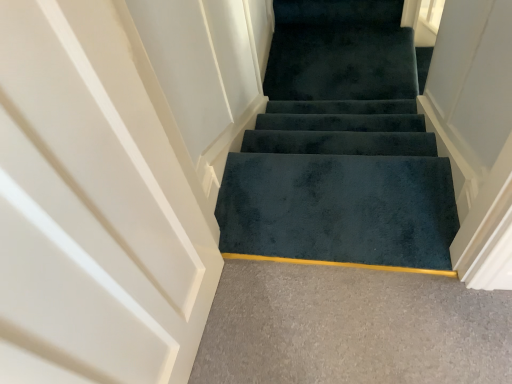
Question: Does dark blue carpet at center have a greater height compared to dark green carpet at center?

Choices:
 (A) yes
 (B) no

Answer: (B)

Question: Does dark blue carpet at center appear on the right side of dark green carpet at center?

Choices:
 (A) yes
 (B) no

Answer: (A)

Question: From a real-world perspective, is dark blue carpet at center positioned under dark green carpet at center based on gravity?

Choices:
 (A) yes
 (B) no

Answer: (A)

Question: Considering the relative positions of dark blue carpet at center and dark green carpet at center in the image provided, is dark blue carpet at center to the left of dark green carpet at center from the viewer's perspective?

Choices:
 (A) yes
 (B) no

Answer: (B)

Question: Is dark green carpet at center at the back of dark blue carpet at center?

Choices:
 (A) no
 (B) yes

Answer: (A)

Question: Is dark blue carpet at center behind dark green carpet at center?

Choices:
 (A) no
 (B) yes

Answer: (B)

Question: Considering the relative sizes of dark blue carpet at center and dark blue carpet at center in the image provided, is dark blue carpet at center shorter than dark blue carpet at center?

Choices:
 (A) yes
 (B) no

Answer: (A)

Question: From the image's perspective, does dark blue carpet at center appear lower than dark blue carpet at center?

Choices:
 (A) no
 (B) yes

Answer: (B)

Question: From a real-world perspective, is dark blue carpet at center on dark blue carpet at center?

Choices:
 (A) no
 (B) yes

Answer: (B)

Question: Is the depth of dark blue carpet at center greater than that of dark blue carpet at center?

Choices:
 (A) yes
 (B) no

Answer: (B)

Question: Considering the relative positions of dark blue carpet at center and dark blue carpet at center in the image provided, is dark blue carpet at center to the left of dark blue carpet at center from the viewer's perspective?

Choices:
 (A) no
 (B) yes

Answer: (B)

Question: From a real-world perspective, is dark blue carpet at center located beneath dark blue carpet at center?

Choices:
 (A) yes
 (B) no

Answer: (B)

Question: Considering the relative sizes of dark green carpet at center and dark blue carpet at center in the image provided, is dark green carpet at center shorter than dark blue carpet at center?

Choices:
 (A) yes
 (B) no

Answer: (B)